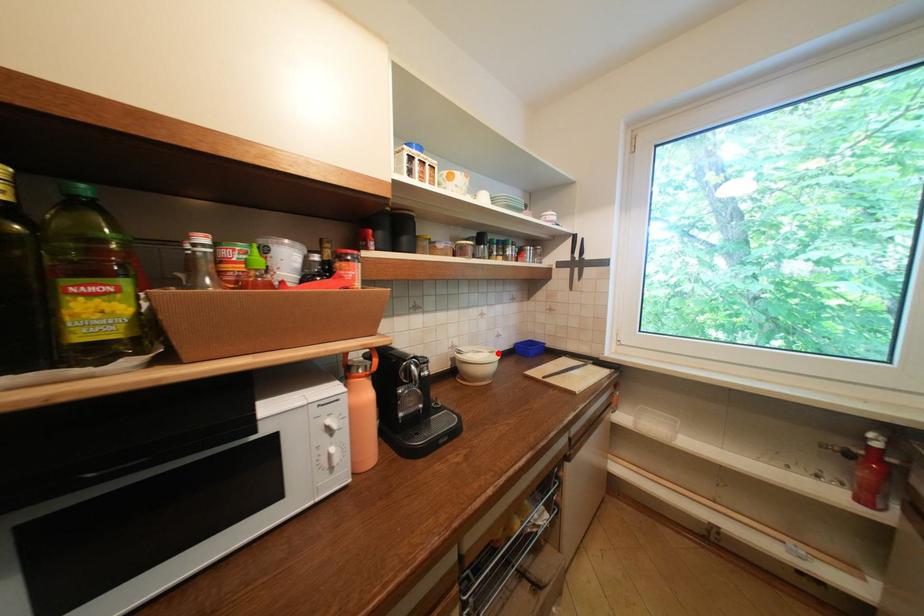
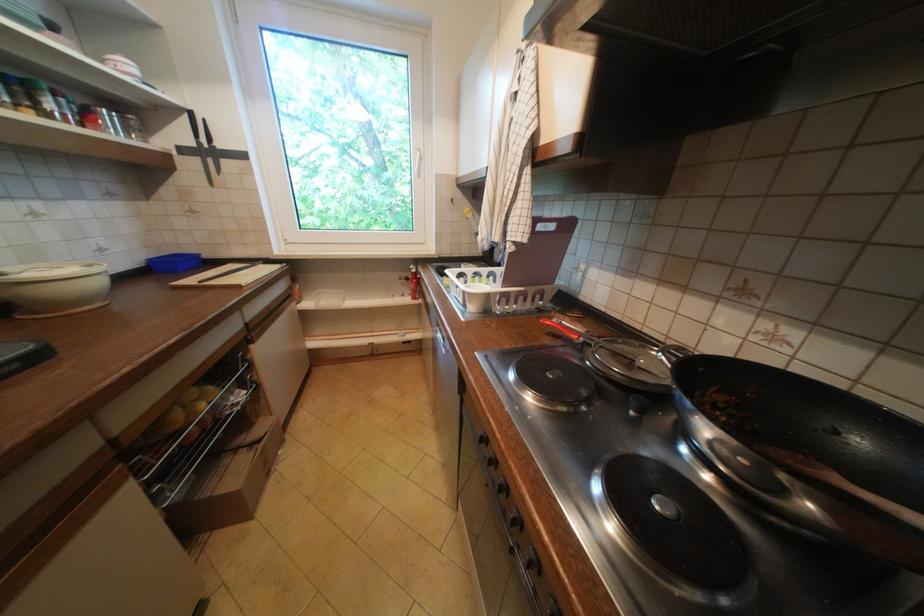
Where in the second image is the point corresponding to the highlighted location from the first image?

(91, 267)